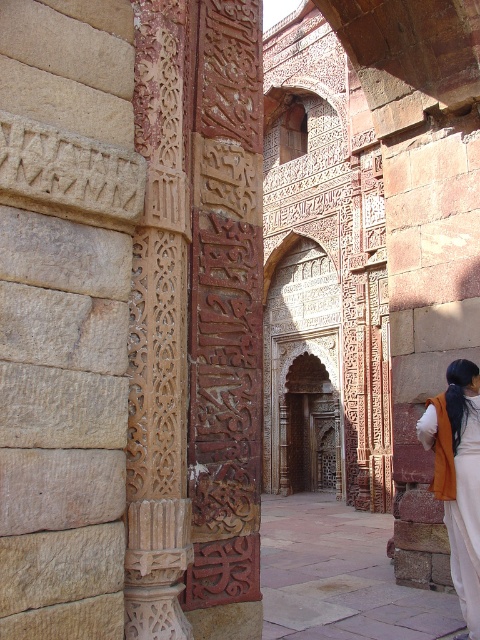
In the scene shown: You are an archaeologist standing 50 feet away from a carved stone inscription at center. Can you read the inscriptions clearly without moving closer?

The carved stone inscription at center is 53.42 feet away from the viewer. Since you are standing 50 feet away, you are still 3.42 feet too far to read the inscriptions clearly without moving closer.

You are an architect examining the historical site. You notice the pink stone courtyard at center and the orange cotton robe at right. Which object is located closer to the ground?

The pink stone courtyard at center is positioned under the orange cotton robe at right, meaning it is closer to the ground.

You are an architect examining the carvings on the red sandstone column. You notice two points marked on the column. The first point is at coordinates point (220, 545) and the second is at point (379, 580). From your perspective, which point is closer to you?

Point (220, 545) is in front of point (379, 580), so it is closer to you.